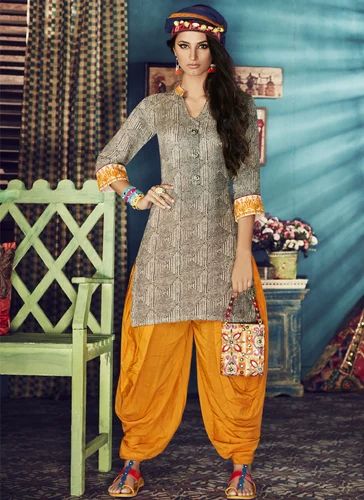
The height and width of the screenshot is (500, 364). Identify the location of wall. (317, 133).